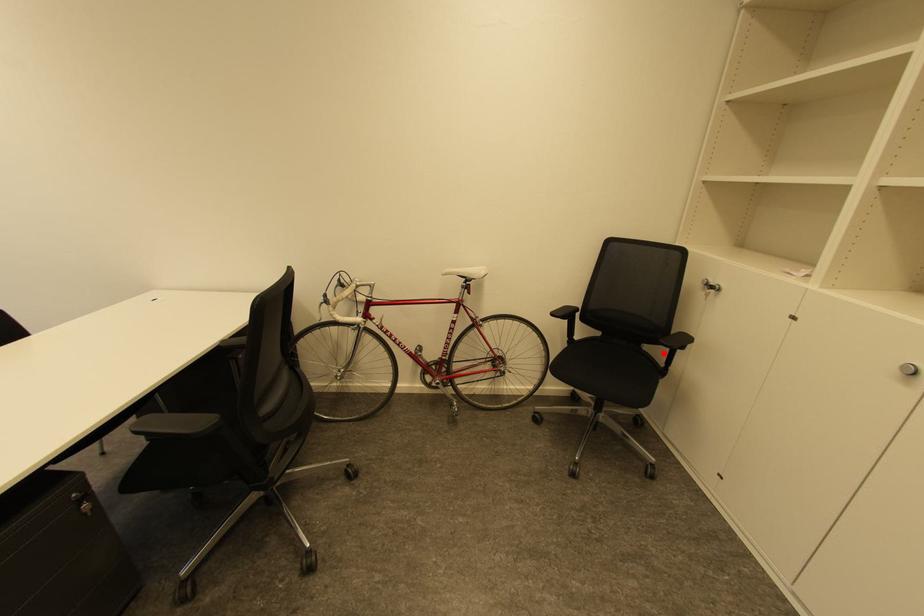
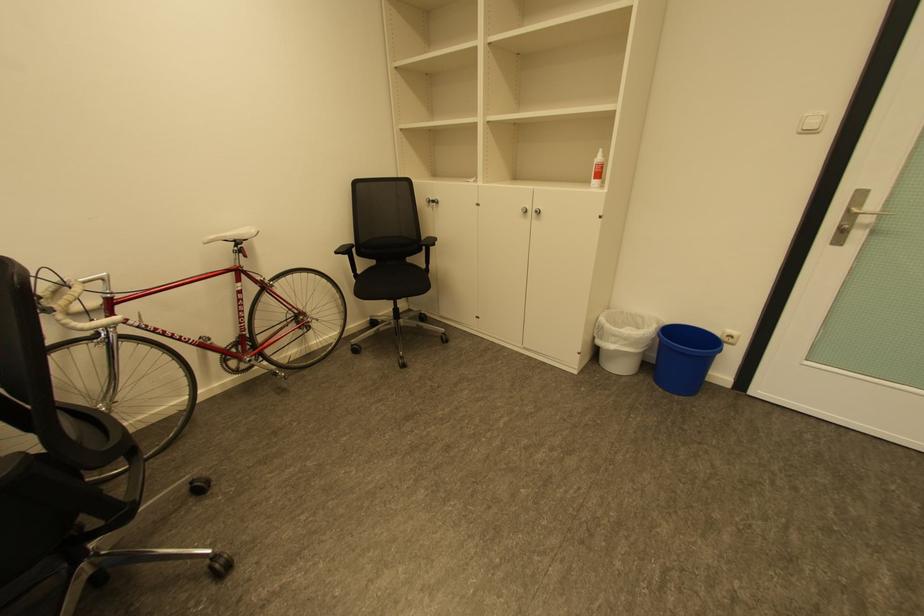
In the second image, find the point that corresponds to the highlighted location in the first image.

(426, 259)